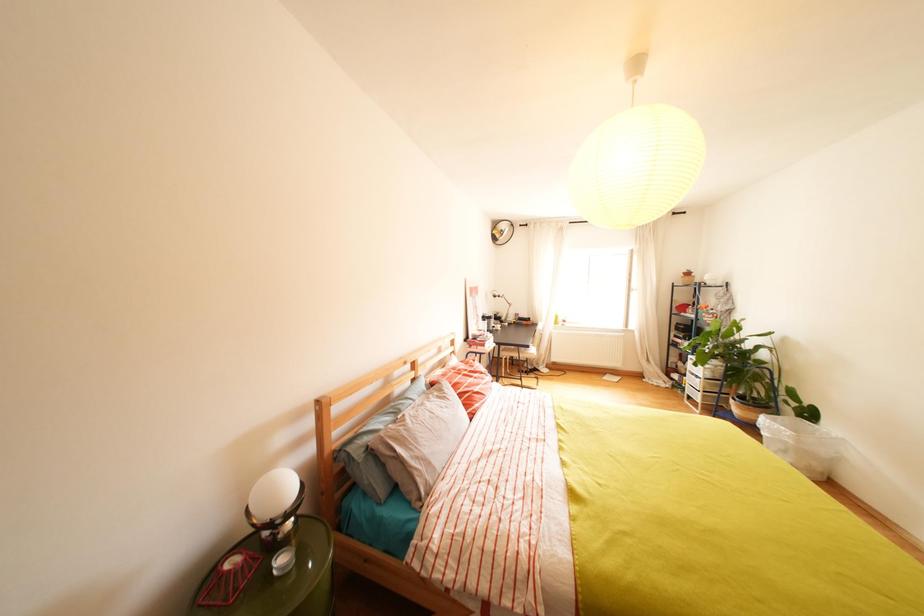
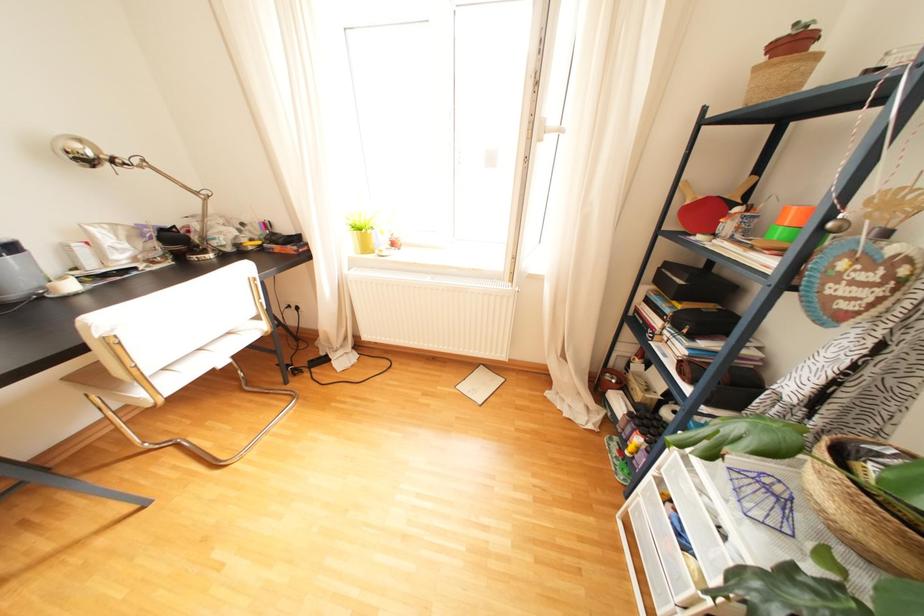
Which direction would the cameraman need to move to produce the second image?

The cameraman moved toward right, forward.